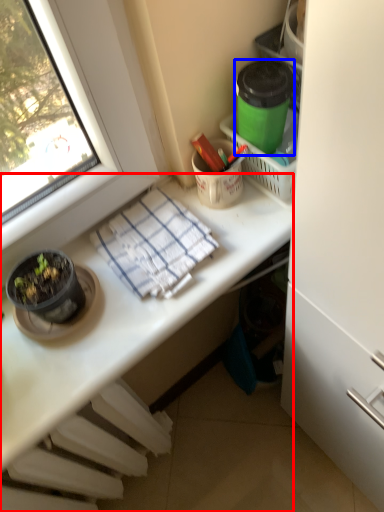
Question: Which of the following is the closest to the observer, desk (highlighted by a red box) or appliance (highlighted by a blue box)?

Choices:
 (A) desk
 (B) appliance

Answer: (A)